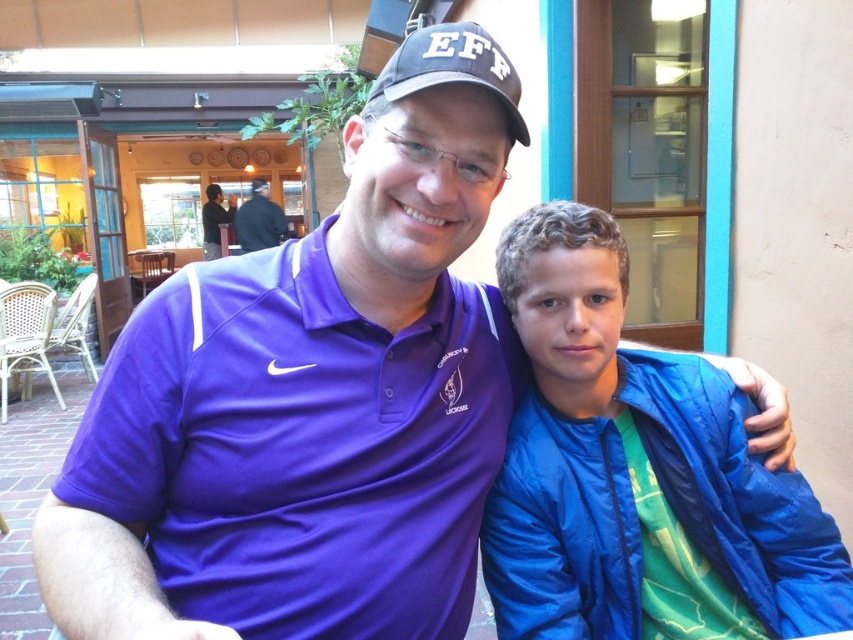
Question: Among these points, which one is nearest to the camera?

Choices:
 (A) (239, 227)
 (B) (351, 324)
 (C) (399, 76)
 (D) (608, 604)

Answer: (C)

Question: From the image, what is the correct spatial relationship of purple polyester polo shirt at center in relation to blue nylon jacket at right?

Choices:
 (A) right
 (B) left

Answer: (B)

Question: Which of the following is the closest to the observer?

Choices:
 (A) blue nylon jacket at right
 (B) black fabric shirt at upper center
 (C) black matte baseball cap at upper center

Answer: (C)

Question: Which point is closer to the camera?

Choices:
 (A) blue nylon jacket at right
 (B) black matte baseball cap at upper center
 (C) black fabric shirt at upper center
 (D) purple polyester polo shirt at center

Answer: (B)

Question: Is purple polyester polo shirt at center closer to the viewer compared to black matte baseball cap at upper center?

Choices:
 (A) yes
 (B) no

Answer: (B)

Question: Can you confirm if purple polyester polo shirt at center is positioned to the left of black fabric shirt at upper center?

Choices:
 (A) yes
 (B) no

Answer: (B)